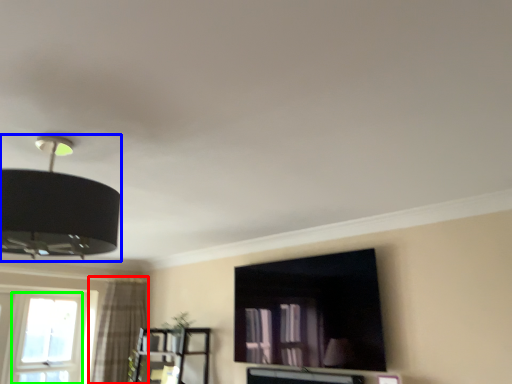
Question: Which object is the farthest from curtain (highlighted by a red box)? Choose among these: lamp (highlighted by a blue box) or window (highlighted by a green box).

Choices:
 (A) lamp
 (B) window

Answer: (A)